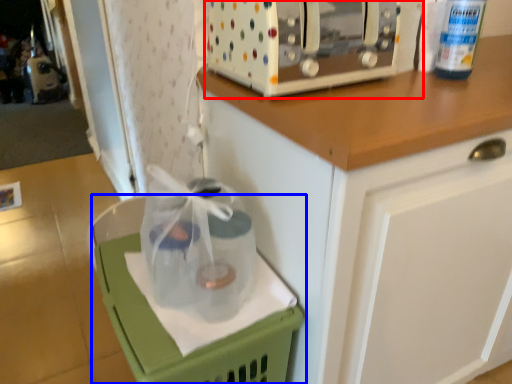
Question: Which of the following is the closest to the observer, home appliance (highlighted by a red box) or basket (highlighted by a blue box)?

Choices:
 (A) home appliance
 (B) basket

Answer: (B)